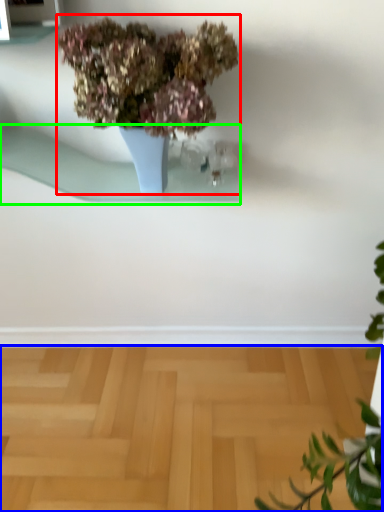
Question: Which is nearer to the houseplant (highlighted by a red box)? surface (highlighted by a blue box) or window sill (highlighted by a green box).

Choices:
 (A) surface
 (B) window sill

Answer: (B)